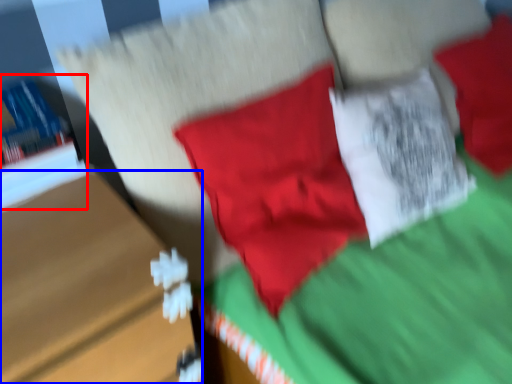
Question: Which of the following is the farthest to the observer, book (highlighted by a red box) or table (highlighted by a blue box)?

Choices:
 (A) book
 (B) table

Answer: (A)